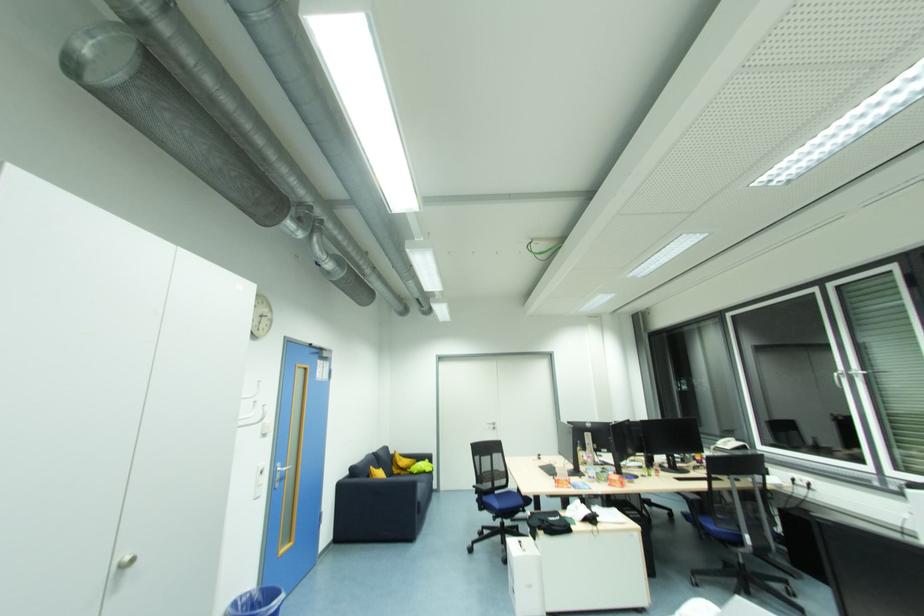
Where would you plac the yellow pillow? Please return your answer as a coordinate pair (x, y).

(400, 463)